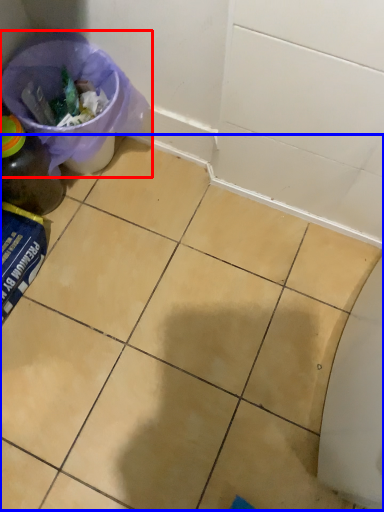
Question: Which object is further to the camera taking this photo, recycling bin (highlighted by a red box) or ceramic tile (highlighted by a blue box)?

Choices:
 (A) recycling bin
 (B) ceramic tile

Answer: (A)